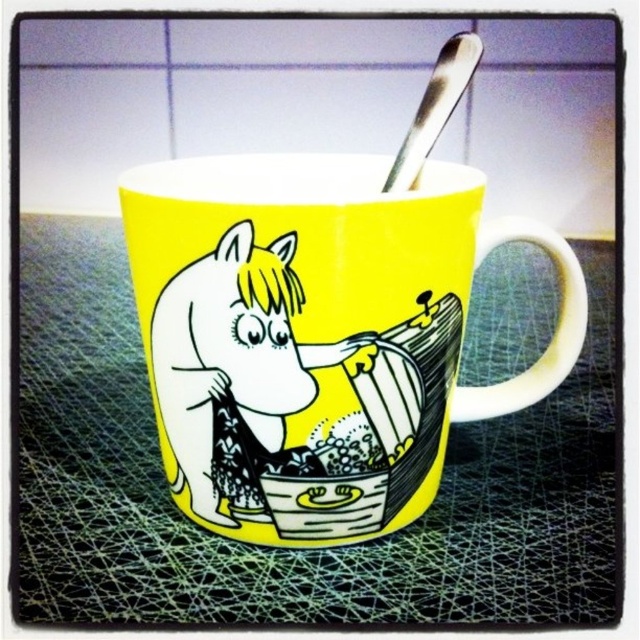
You are a delivery robot with a 3 inch wide arm. You need to place a small package between the yellow ceramic mug at center and the matte yellow horse at center. Can your arm fit between them without touching either object?

The yellow ceramic mug at center is 2.78 inches from matte yellow horse at center. Since your arm is 3 inches wide, it cannot fit between them without touching the objects.

You are looking at the image of the mug and want to place a sticker on the part of the mug that is closer to you. Which point should you choose between point (257, 284) and point (244, 344)?

Point (257, 284) is closer to the viewer than point (244, 344), so you should choose point (257, 284) to place the sticker.

You are a robotic arm trying to pick up the yellow ceramic mug at center. The robotic arm can only move in a straight line from its current position at point A. If point A is at coordinates 0.5, 0.5, will the robotic arm be able to reach the mug without any obstacles?

The yellow ceramic mug at center is located at point (317, 332), which is very close to point A at (320, 320). The robotic arm can move in a straight line to reach it, so yes, the robotic arm can reach the yellow ceramic mug at center without any obstacles.